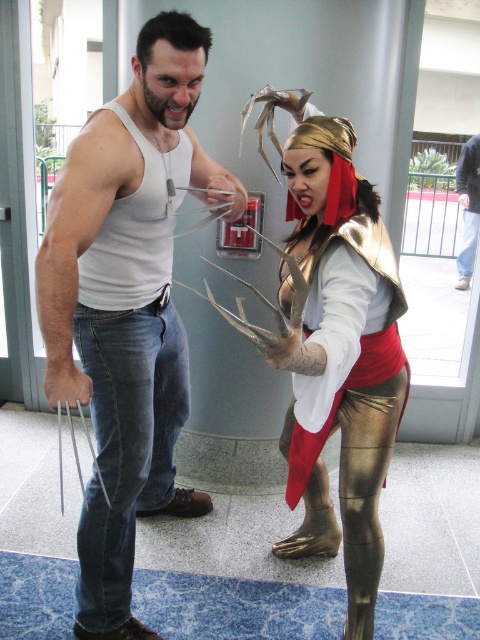
You are a photographer at a cosplay event and need to capture a photo of the matte white tank top at center and the gold metallic costume at center. The camera you are using has a minimum focus distance of 40 centimeters. Will you be able to take a clear photo of both subjects without moving the camera?

The distance between the matte white tank top at center and the gold metallic costume at center is 43.48 centimeters, which is greater than the camera minimum focus distance of 40 centimeters. Therefore, the camera can focus on both subjects and take a clear photo without moving.

Based on the photo, you are holding a camera and want to take a photo of the matte white tank top at center. If you are currently 5.03 feet away, is that the ideal distance for a closeup shot?

Yes, since the matte white tank top at center and camera are 5.03 feet apart from each other, this distance is suitable for a closeup shot.

You are a photographer at a cosplay event. You need to decide which clothing item to focus on for a closeup shot. The matte white tank top at center and the gold metallic costume at center are both in the frame. Which one has a larger surface area to capture clearly?

The matte white tank top at center is bigger than the gold metallic costume at center, so it has a larger surface area and would be easier to capture clearly in a closeup shot.